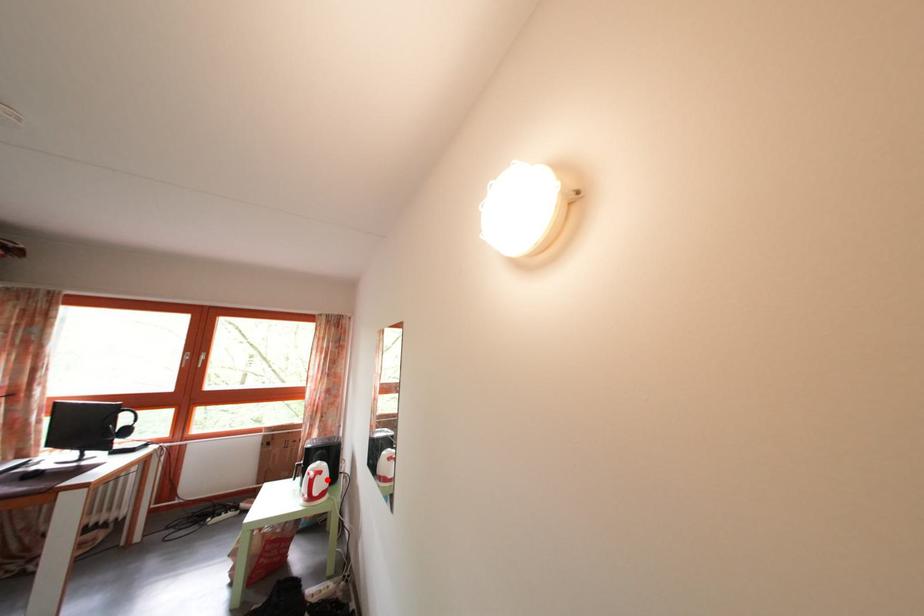
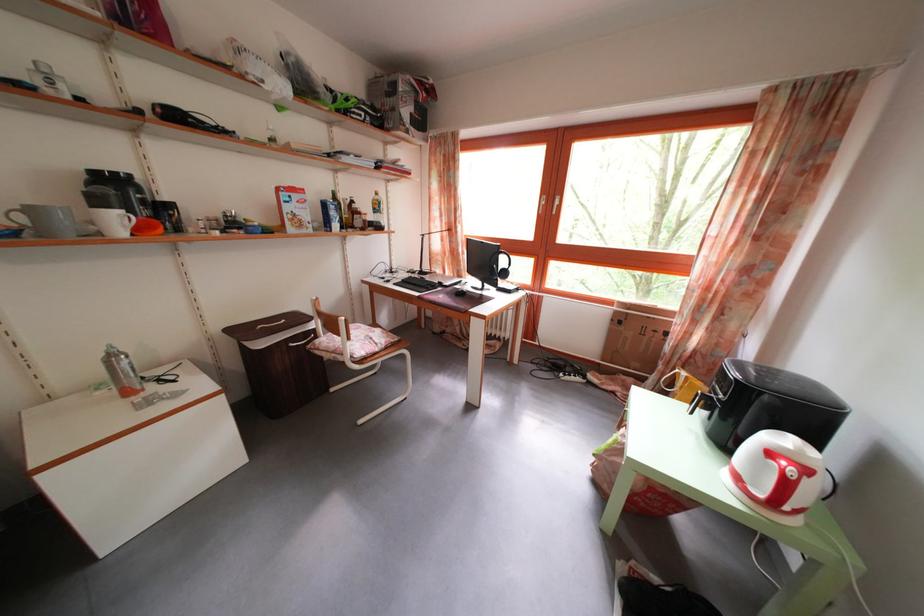
The point at the highlighted location is marked in the first image. Where is the corresponding point in the second image?

(812, 477)